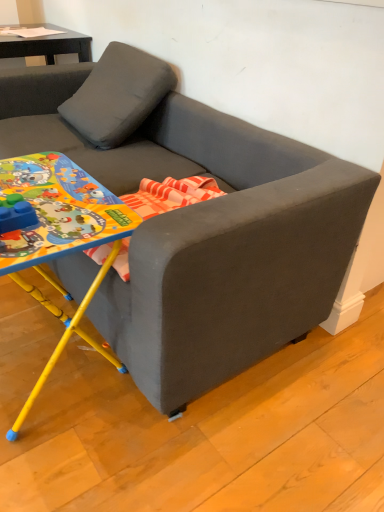
Question: Is matte gray couch at center outside of yellow plastic table at lower left?

Choices:
 (A) yes
 (B) no

Answer: (A)

Question: From the image's perspective, is matte gray couch at center on yellow plastic table at lower left?

Choices:
 (A) no
 (B) yes

Answer: (B)

Question: Is matte gray couch at center closer to camera compared to yellow plastic table at lower left?

Choices:
 (A) no
 (B) yes

Answer: (B)

Question: Is matte gray couch at center further to the viewer compared to yellow plastic table at lower left?

Choices:
 (A) no
 (B) yes

Answer: (A)

Question: Is matte gray couch at center turned away from yellow plastic table at lower left?

Choices:
 (A) no
 (B) yes

Answer: (B)

Question: Considering the relative sizes of matte gray couch at center and yellow plastic table at lower left in the image provided, is matte gray couch at center thinner than yellow plastic table at lower left?

Choices:
 (A) no
 (B) yes

Answer: (A)

Question: Can matte gray couch at center be found inside yellow plastic table at lower left?

Choices:
 (A) yes
 (B) no

Answer: (B)

Question: Considering the relative positions of yellow plastic table at lower left and matte gray couch at center in the image provided, is yellow plastic table at lower left to the left of matte gray couch at center from the viewer's perspective?

Choices:
 (A) yes
 (B) no

Answer: (A)

Question: Is yellow plastic table at lower left beside matte gray couch at center?

Choices:
 (A) no
 (B) yes

Answer: (A)

Question: Is yellow plastic table at lower left wider than matte gray couch at center?

Choices:
 (A) no
 (B) yes

Answer: (A)

Question: Can you confirm if yellow plastic table at lower left is positioned to the right of matte gray couch at center?

Choices:
 (A) no
 (B) yes

Answer: (A)

Question: From the image's perspective, is yellow plastic table at lower left located above matte gray couch at center?

Choices:
 (A) yes
 (B) no

Answer: (B)

Question: From the image's perspective, is matte gray couch at center above or below yellow plastic table at lower left?

Choices:
 (A) below
 (B) above

Answer: (B)